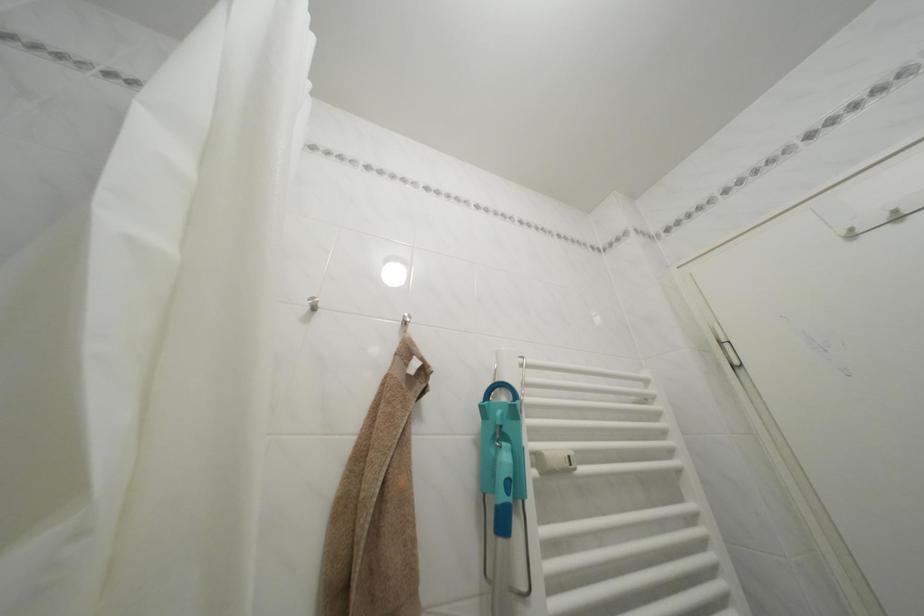
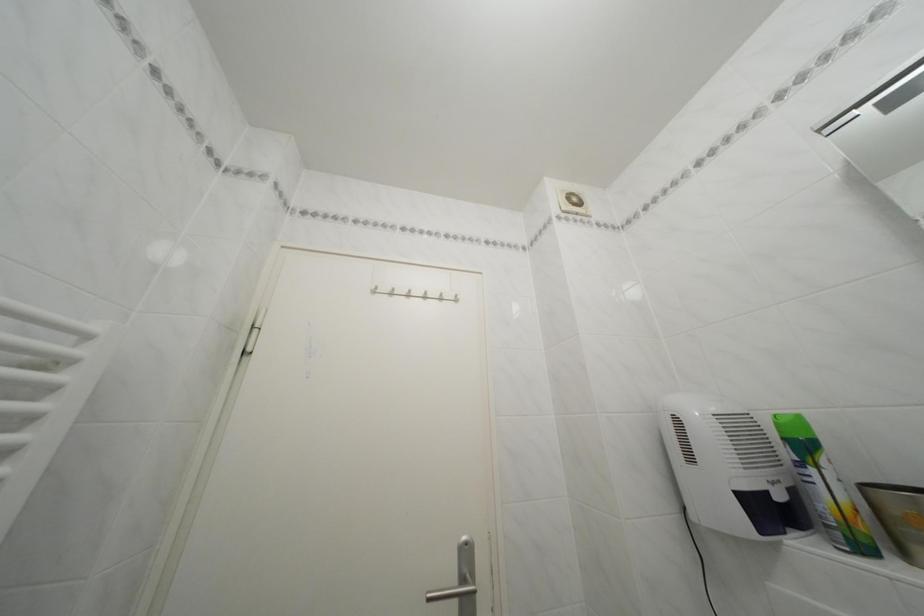
Locate, in the second image, the point that corresponds to point 860,236 in the first image.

(385, 294)